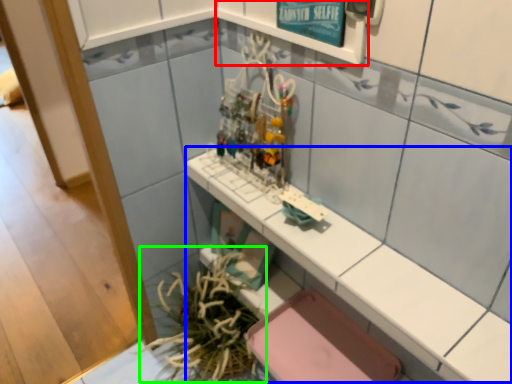
Question: Based on their relative distances, which object is farther from shelf (highlighted by a red box)? Choose from counter top (highlighted by a blue box) and plant (highlighted by a green box).

Choices:
 (A) counter top
 (B) plant

Answer: (B)